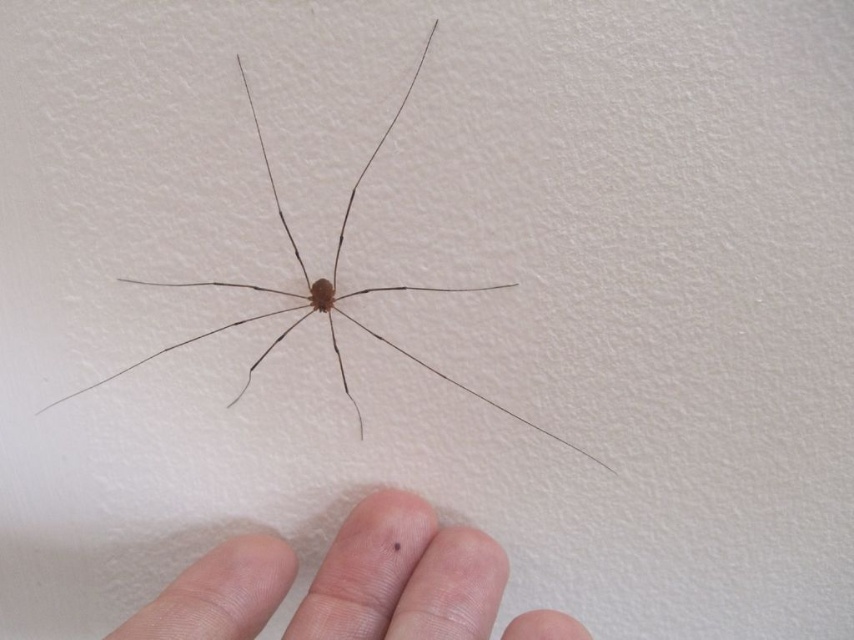
Is pale skin finger at lower center shorter than brown matte spider at center?

Correct, pale skin finger at lower center is not as tall as brown matte spider at center.

This screenshot has height=640, width=854. I want to click on pale skin finger at lower center, so click(402, 577).

This screenshot has width=854, height=640. Find the location of `pale skin finger at lower center`. pale skin finger at lower center is located at coordinates (402, 577).